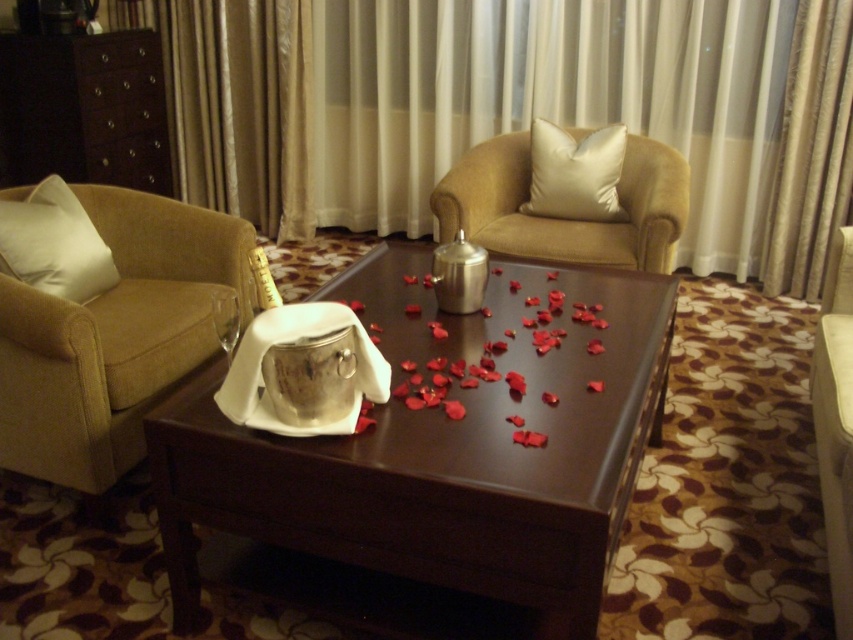
Between point (105, 420) and point (831, 440), which one is positioned behind?

Positioned behind is point (105, 420).

In the scene shown: Who is higher up, matte beige armchair at left or beige fabric armchair at right?

matte beige armchair at left is higher up.

Who is more distant from viewer, (120, 474) or (844, 525)?

Positioned behind is point (120, 474).

This screenshot has height=640, width=853. I want to click on matte beige armchair at left, so click(119, 336).

How much distance is there between brown leather table at center and matte beige armchair at left?

brown leather table at center is 24.44 inches away from matte beige armchair at left.

Does brown leather table at center appear on the right side of matte beige armchair at left?

Correct, you'll find brown leather table at center to the right of matte beige armchair at left.

The height and width of the screenshot is (640, 853). What do you see at coordinates (440, 449) in the screenshot? I see `brown leather table at center` at bounding box center [440, 449].

The image size is (853, 640). Identify the location of brown leather table at center. (440, 449).

Can you confirm if beige fabric armchair at right is positioned below white soft pillow at left?

Yes.

Between beige fabric armchair at right and white soft pillow at left, which one is positioned lower?

Positioned lower is beige fabric armchair at right.

Does point (811, 419) lie behind point (39, 234)?

Yes.

Locate an element on the screen. beige fabric armchair at right is located at coordinates (834, 422).